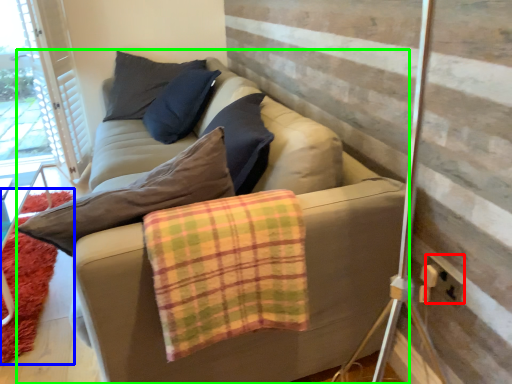
Question: Estimate the real-world distances between objects in this image. Which object is farther from electric outlet (highlighted by a red box), mat (highlighted by a blue box) or studio couch (highlighted by a green box)?

Choices:
 (A) mat
 (B) studio couch

Answer: (A)